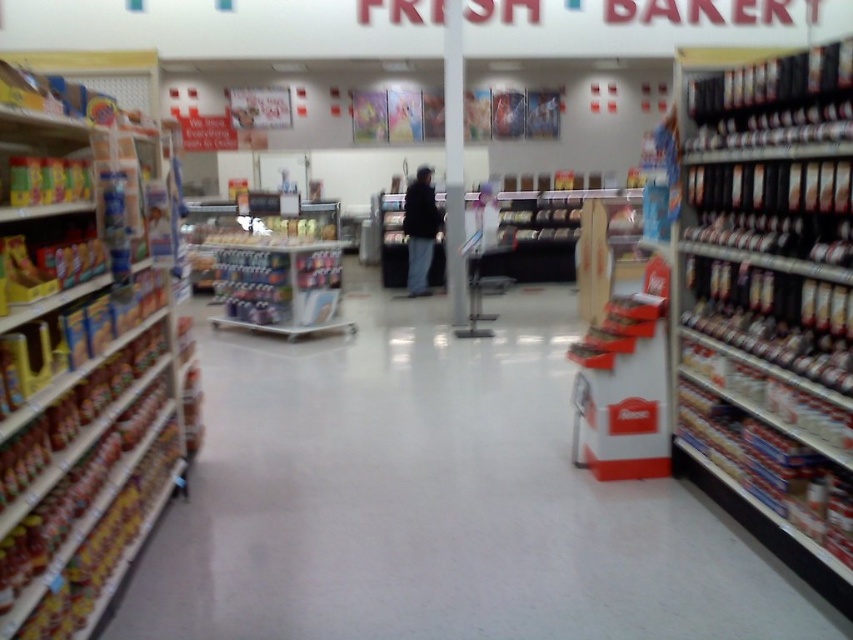
Does matte cardboard shelf at left appear on the right side of black leather jacket at center?

In fact, matte cardboard shelf at left is to the left of black leather jacket at center.

Between matte cardboard shelf at left and black leather jacket at center, which one appears on the left side from the viewer's perspective?

matte cardboard shelf at left is more to the left.

Identify the location of matte cardboard shelf at left. The height and width of the screenshot is (640, 853). (85, 364).

The image size is (853, 640). In order to click on matte cardboard shelf at left in this screenshot , I will do `click(85, 364)`.

This screenshot has width=853, height=640. What are the coordinates of `white glossy pillar at center` in the screenshot? It's located at (454, 163).

Who is more distant from viewer, (x=460, y=58) or (x=405, y=212)?

The point (x=405, y=212) is behind.

Is point (444, 230) positioned behind point (421, 218)?

Yes, point (444, 230) is farther from viewer.

I want to click on white glossy pillar at center, so click(x=454, y=163).

Between matte cardboard shelf at left and white glossy pillar at center, which one appears on the right side from the viewer's perspective?

white glossy pillar at center is more to the right.

This screenshot has height=640, width=853. In order to click on matte cardboard shelf at left in this screenshot , I will do tap(85, 364).